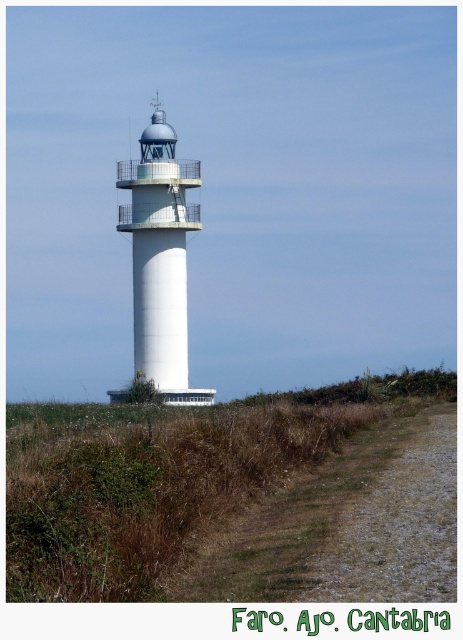
Question: Can you confirm if green grass at center is smaller than white smooth lighthouse at center?

Choices:
 (A) yes
 (B) no

Answer: (A)

Question: Does green grass at center appear on the left side of white smooth lighthouse at center?

Choices:
 (A) yes
 (B) no

Answer: (B)

Question: Is green grass at center to the right of white smooth lighthouse at center from the viewer's perspective?

Choices:
 (A) yes
 (B) no

Answer: (A)